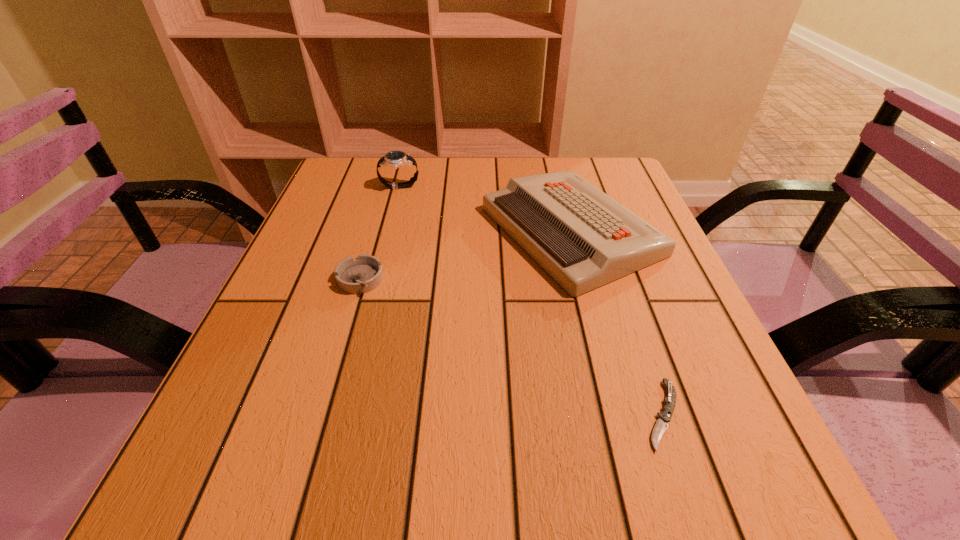
At what (x,y) coordinates should I click in order to perform the action: click on computer keyboard that is at the far edge. Please return your answer as a coordinate pair (x, y). Looking at the image, I should click on (583, 238).

The height and width of the screenshot is (540, 960). I want to click on object present at the near edge, so click(x=664, y=417).

Find the location of a particular element. The image size is (960, 540). watch that is at the left edge is located at coordinates (394, 159).

Identify the location of ashtray that is at the left edge. Image resolution: width=960 pixels, height=540 pixels. (363, 274).

At what (x,y) coordinates should I click in order to perform the action: click on computer keyboard positioned at the right edge. Please return your answer as a coordinate pair (x, y). This screenshot has height=540, width=960. Looking at the image, I should click on (583, 238).

Find the location of `pocketknife at the right edge`. pocketknife at the right edge is located at coordinates (664, 417).

Image resolution: width=960 pixels, height=540 pixels. In order to click on object located in the far left corner section of the desktop in this screenshot , I will do `click(394, 159)`.

Find the location of `object that is at the far right corner`. object that is at the far right corner is located at coordinates (583, 238).

You are a GUI agent. You are given a task and a screenshot of the screen. Output one action in this format:
    pyautogui.click(x=<x>, y=<y>)
    Task: Click on the object present at the near right corner
    This screenshot has width=960, height=540.
    Given the screenshot: What is the action you would take?
    pyautogui.click(x=664, y=417)

At what (x,y) coordinates should I click in order to perform the action: click on vacant region at the far edge of the desktop. Please return your answer as a coordinate pair (x, y). Looking at the image, I should click on (426, 189).